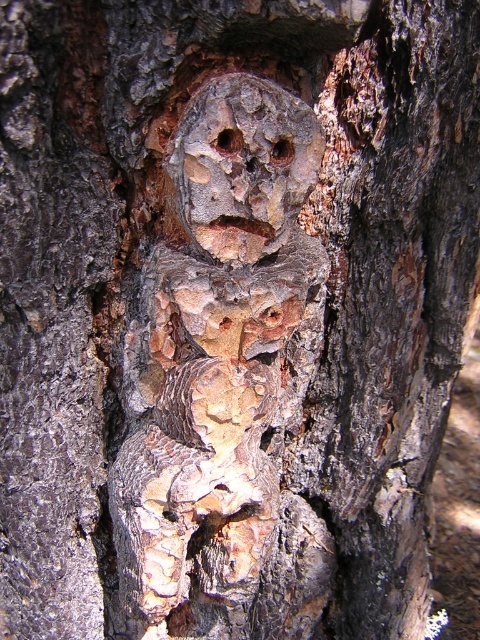
Question: Can you confirm if brown rough bark hole at center is bigger than smooth wood hole at center?

Choices:
 (A) no
 (B) yes

Answer: (A)

Question: Which point is closer to the camera?

Choices:
 (A) smooth wood hole at center
 (B) brown rough bark hole at center
 (C) rustic bark face at upper center

Answer: (C)

Question: Among these objects, which one is farthest from the camera?

Choices:
 (A) smooth wood hole at center
 (B) brown rough bark hole at center
 (C) rustic bark face at upper center

Answer: (A)

Question: Which point appears farthest from the camera in this image?

Choices:
 (A) (276, 141)
 (B) (229, 148)
 (C) (288, 198)

Answer: (C)

Question: Does rustic bark face at upper center lie behind brown rough bark hole at center?

Choices:
 (A) no
 (B) yes

Answer: (A)

Question: Is the position of brown rough bark hole at center less distant than that of smooth wood hole at center?

Choices:
 (A) no
 (B) yes

Answer: (B)